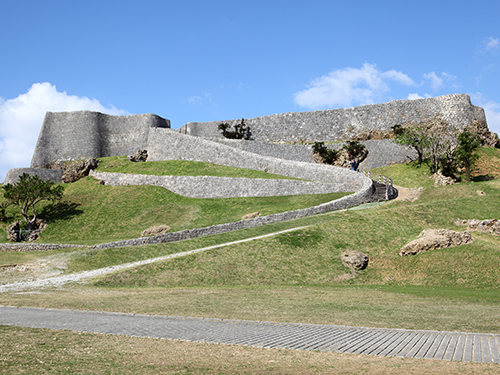
Identify the location of stairs. (380, 188).